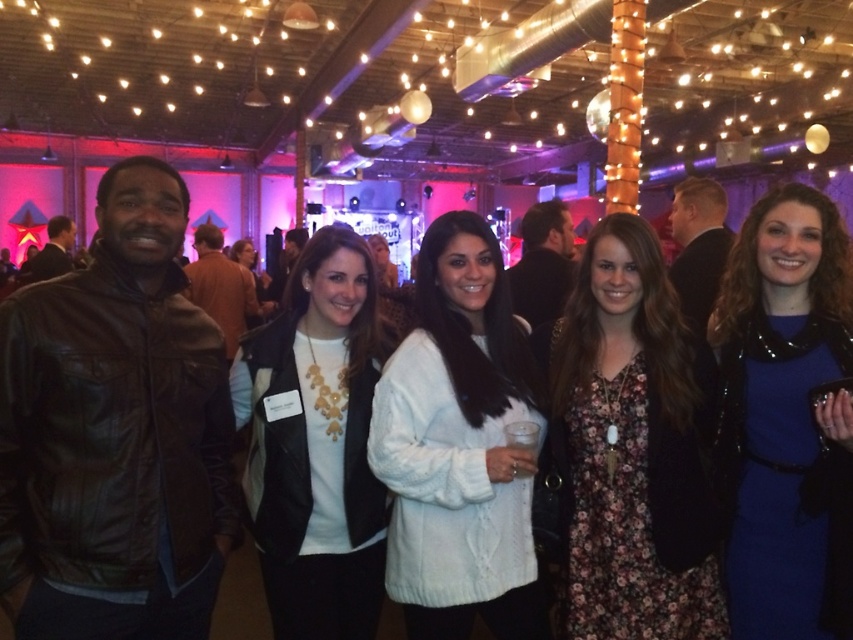
Consider the image. You are standing at the point marked as point (502, 525) in the image. The event organizers have placed a snack table 6 feet away from your current position. Can you reach the snack table without moving more than 6.53 feet?

The distance between you and the viewer is 6.53 feet. Since the snack table is 6 feet away from your current position, you can reach it without moving more than 6.53 feet.

You are a photographer holding a camera that requires a minimum distance of 12 inches to focus properly. You are taking a photo of two white sweaters in the center of the image, specifically the white knitted sweater at center and the white matte sweater at center. Can you focus on both of them clearly?

The white knitted sweater at center is 10.47 inches away from the white matte sweater at center, which is less than the required 12 inches minimum distance for proper focus. Therefore, the camera may not be able to focus on both clearly.